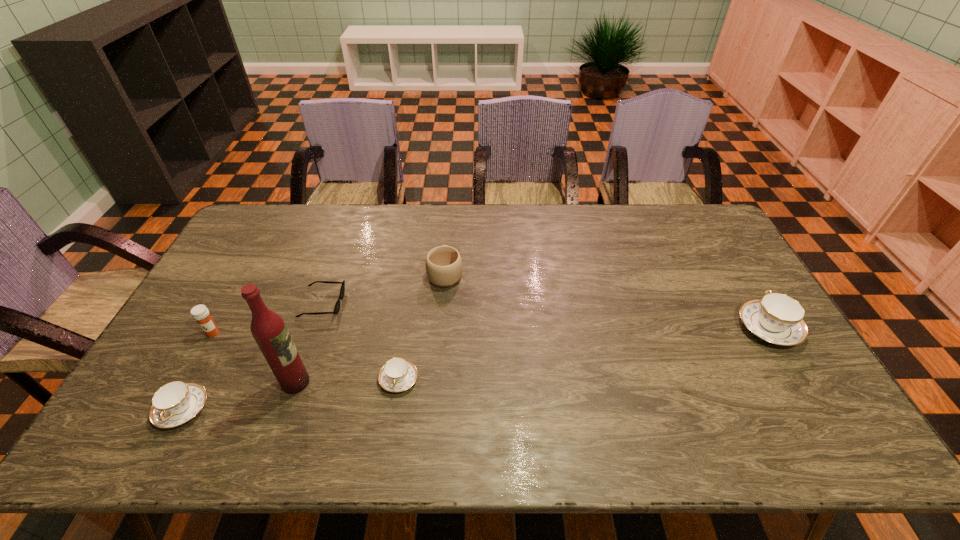
Identify the location of vacant region located on the side with the handle of the rightmost object. The height and width of the screenshot is (540, 960). (708, 228).

The image size is (960, 540). I want to click on vacant region located 0.120m on the side with the handle of the rightmost object, so click(738, 278).

Where is `free space located 0.080m on the side with the handle of the rightmost object`? The height and width of the screenshot is (540, 960). free space located 0.080m on the side with the handle of the rightmost object is located at coordinates click(x=744, y=287).

In order to click on blank area located on the side of the mug with the handle in this screenshot , I will do coord(450,214).

You are a GUI agent. You are given a task and a screenshot of the screen. Output one action in this format:
    pyautogui.click(x=<x>, y=<y>)
    Task: Click on the vacant space located 0.290m on the side of the mug with the handle
    The width and height of the screenshot is (960, 540).
    Given the screenshot: What is the action you would take?
    pyautogui.click(x=450, y=208)

Locate an element on the screen. This screenshot has width=960, height=540. vacant space situated 0.070m on the side of the mug with the handle is located at coordinates (447, 245).

Locate an element on the screen. The height and width of the screenshot is (540, 960). free space located on the label of the liquor is located at coordinates (398, 382).

You are a GUI agent. You are given a task and a screenshot of the screen. Output one action in this format:
    pyautogui.click(x=<x>, y=<y>)
    Task: Click on the free space located 0.320m on the front-facing side of the sunglasses
    Image resolution: width=960 pixels, height=540 pixels.
    Given the screenshot: What is the action you would take?
    pyautogui.click(x=447, y=303)

Image resolution: width=960 pixels, height=540 pixels. In order to click on blank space located on the label side of the medicine in this screenshot , I will do `click(199, 359)`.

The height and width of the screenshot is (540, 960). In order to click on liquor present at the near edge in this screenshot , I will do `click(268, 328)`.